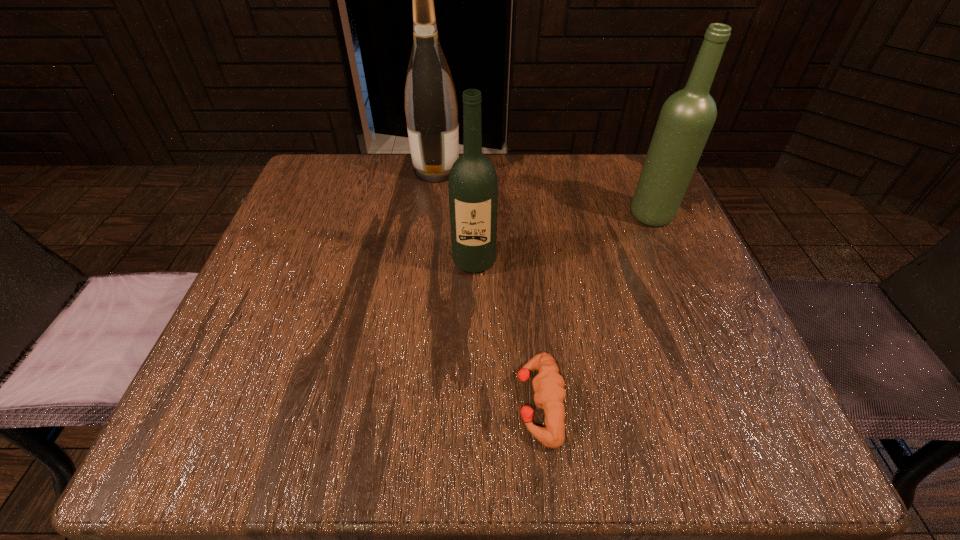
Select which object appears as the closest to the nearest wine bottle. Please provide its 2D coordinates. Your answer should be formatted as a tuple, i.e. [(x, y)], where the tuple contains the x and y coordinates of a point satisfying the conditions above.

[(548, 384)]

The height and width of the screenshot is (540, 960). What are the coordinates of `object that is the second closest one to the rightmost object` in the screenshot? It's located at (431, 108).

Select which wine bottle is the closest to the farthest wine bottle. Please provide its 2D coordinates. Your answer should be formatted as a tuple, i.e. [(x, y)], where the tuple contains the x and y coordinates of a point satisfying the conditions above.

[(473, 185)]

The width and height of the screenshot is (960, 540). In order to click on wine bottle object that ranks as the second closest to the rightmost wine bottle in this screenshot , I will do `click(431, 108)`.